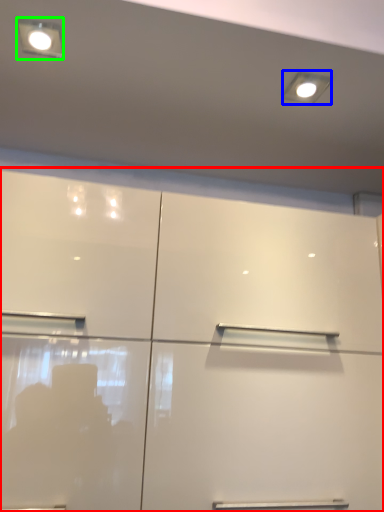
Question: Estimate the real-world distances between objects in this image. Which object is closer to cupboard (highlighted by a red box), lighting (highlighted by a blue box) or light fixture (highlighted by a green box)?

Choices:
 (A) lighting
 (B) light fixture

Answer: (A)